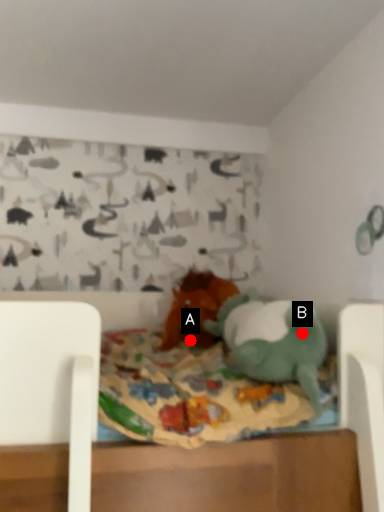
Question: Two points are circled on the image, labeled by A and B beside each circle. Which point appears farthest from the camera in this image?

Choices:
 (A) A is further
 (B) B is further

Answer: (A)